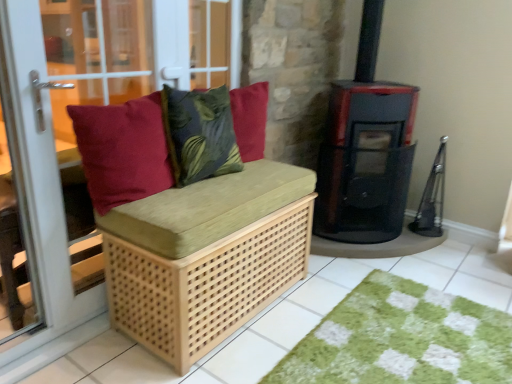
Question: Does black matte stove at center right have a larger size compared to natural wood bench at left?

Choices:
 (A) no
 (B) yes

Answer: (A)

Question: Is black matte stove at center right smaller than natural wood bench at left?

Choices:
 (A) no
 (B) yes

Answer: (B)

Question: Considering the relative positions of black matte stove at center right and natural wood bench at left in the image provided, is black matte stove at center right in front of natural wood bench at left?

Choices:
 (A) no
 (B) yes

Answer: (A)

Question: Would you say black matte stove at center right contains natural wood bench at left?

Choices:
 (A) yes
 (B) no

Answer: (B)

Question: Are black matte stove at center right and natural wood bench at left beside each other?

Choices:
 (A) yes
 (B) no

Answer: (B)

Question: From their relative heights in the image, would you say velvety green leaf-patterned pillow at center is taller or shorter than natural wood bench cushion at center?

Choices:
 (A) short
 (B) tall

Answer: (A)

Question: In the image, is velvety green leaf-patterned pillow at center positioned in front of or behind natural wood bench cushion at center?

Choices:
 (A) behind
 (B) front

Answer: (A)

Question: From a real-world perspective, is velvety green leaf-patterned pillow at center positioned above or below natural wood bench cushion at center?

Choices:
 (A) above
 (B) below

Answer: (A)

Question: Considering the positions of velvety green leaf-patterned pillow at center and natural wood bench cushion at center in the image, is velvety green leaf-patterned pillow at center wider or thinner than natural wood bench cushion at center?

Choices:
 (A) wide
 (B) thin

Answer: (B)

Question: From a real-world perspective, is black glossy wood burning stove at right above or below matte wood bench at left?

Choices:
 (A) above
 (B) below

Answer: (A)

Question: Does point (329, 152) appear closer or farther from the camera than point (24, 246)?

Choices:
 (A) farther
 (B) closer

Answer: (A)

Question: In terms of height, does black glossy wood burning stove at right look taller or shorter compared to matte wood bench at left?

Choices:
 (A) tall
 (B) short

Answer: (A)

Question: Relative to matte wood bench at left, is black glossy wood burning stove at right in front or behind?

Choices:
 (A) behind
 (B) front

Answer: (A)

Question: Choose the correct answer: Is natural wood bench at left inside matte wood bench at left or outside it?

Choices:
 (A) outside
 (B) inside

Answer: (A)

Question: In the image, is natural wood bench at left positioned in front of or behind matte wood bench at left?

Choices:
 (A) front
 (B) behind

Answer: (B)